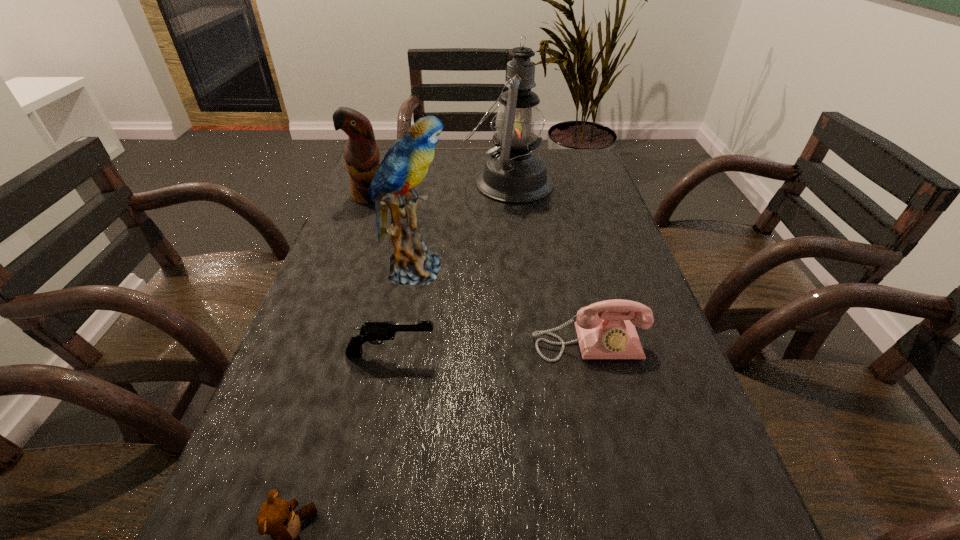
This screenshot has width=960, height=540. I want to click on vacant area at the far right corner of the desktop, so click(x=565, y=148).

Find the location of `free space between the right parrot and the oil lamp`. free space between the right parrot and the oil lamp is located at coordinates (461, 226).

Find the location of a particular element. The image size is (960, 540). free space between the oil lamp and the gun is located at coordinates (449, 268).

Locate an element on the screen. unoccupied position between the fourth tallest object and the gun is located at coordinates (490, 348).

Locate an element on the screen. vacant area that lies between the farther parrot and the third shortest object is located at coordinates (479, 269).

Find the location of `vacant space in between the gun and the taller parrot`. vacant space in between the gun and the taller parrot is located at coordinates (402, 311).

Select which object appears as the third closest to the oil lamp. Please provide its 2D coordinates. Your answer should be formatted as a tuple, i.e. [(x, y)], where the tuple contains the x and y coordinates of a point satisfying the conditions above.

[(611, 334)]

This screenshot has height=540, width=960. What are the coordinates of `object that stands as the second closest to the oil lamp` in the screenshot? It's located at (361, 155).

The image size is (960, 540). In order to click on free space that satisfies the following two spatial constraints: 1. on the dial of the third shortest object; 2. at the end of the barrel of the gun in this screenshot , I will do `click(591, 353)`.

This screenshot has width=960, height=540. In order to click on free space that satisfies the following two spatial constraints: 1. on the dial of the fourth tallest object; 2. at the end of the barrel of the gun in this screenshot , I will do `click(591, 353)`.